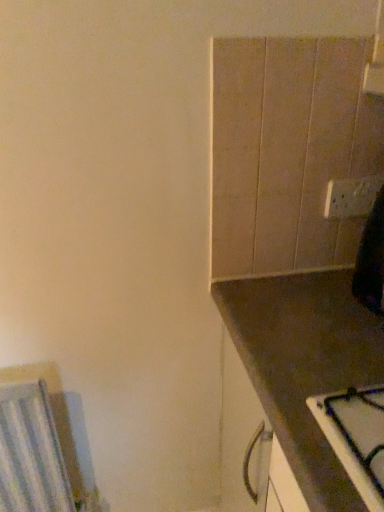
At what (x,y) coordinates should I click in order to perform the action: click on empty space that is ontop of brown matte countertop at right (from a real-world perspective). Please return your answer as a coordinate pair (x, y). Image resolution: width=384 pixels, height=512 pixels. Looking at the image, I should click on (314, 312).